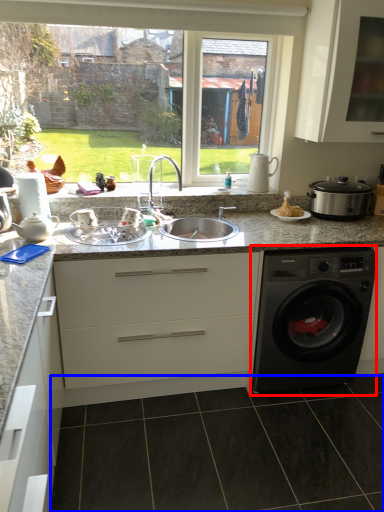
Question: Which point is further to the camera, washing machine (highlighted by a red box) or tile (highlighted by a blue box)?

Choices:
 (A) washing machine
 (B) tile

Answer: (A)